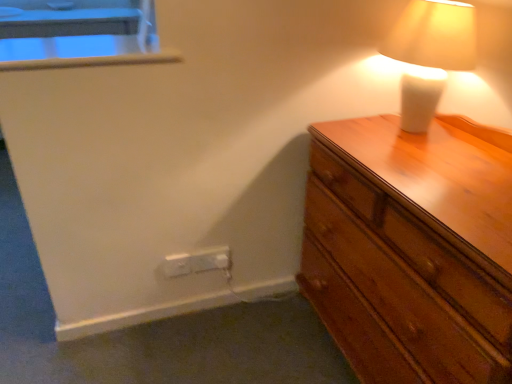
Question: Does white plastic electric outlet at lower center, the second electric outlet positioned from the left, have a greater width compared to white plastic window sill at upper left?

Choices:
 (A) yes
 (B) no

Answer: (B)

Question: Considering the relative sizes of white plastic electric outlet at lower center, which ranks as the first electric outlet in right-to-left order, and white plastic window sill at upper left in the image provided, is white plastic electric outlet at lower center, which ranks as the first electric outlet in right-to-left order, thinner than white plastic window sill at upper left?

Choices:
 (A) yes
 (B) no

Answer: (A)

Question: Considering the relative sizes of white plastic electric outlet at lower center, the second electric outlet positioned from the left, and white plastic window sill at upper left in the image provided, is white plastic electric outlet at lower center, the second electric outlet positioned from the left, taller than white plastic window sill at upper left?

Choices:
 (A) no
 (B) yes

Answer: (B)

Question: From the image's perspective, is white plastic electric outlet at lower center, the second electric outlet positioned from the left, beneath white plastic window sill at upper left?

Choices:
 (A) no
 (B) yes

Answer: (B)

Question: Is white plastic electric outlet at lower center, which ranks as the first electric outlet in right-to-left order, far away from white plastic window sill at upper left?

Choices:
 (A) no
 (B) yes

Answer: (A)

Question: Does white plastic electric outlet at lower center, the second electric outlet positioned from the left, have a smaller size compared to white plastic window sill at upper left?

Choices:
 (A) no
 (B) yes

Answer: (B)

Question: Is white ceramic lamp at upper right in front of white plastic electric outlet at lower left, the first electric outlet from the left?

Choices:
 (A) no
 (B) yes

Answer: (B)

Question: Can you confirm if white ceramic lamp at upper right is positioned to the left of white plastic electric outlet at lower left, which ranks as the 2th electric outlet in right-to-left order?

Choices:
 (A) no
 (B) yes

Answer: (A)

Question: Does white ceramic lamp at upper right have a lesser width compared to white plastic electric outlet at lower left, the first electric outlet from the left?

Choices:
 (A) no
 (B) yes

Answer: (A)

Question: Does white ceramic lamp at upper right have a greater width compared to white plastic electric outlet at lower left, the first electric outlet from the left?

Choices:
 (A) no
 (B) yes

Answer: (B)

Question: Considering the relative sizes of white ceramic lamp at upper right and white plastic electric outlet at lower left, which ranks as the 2th electric outlet in right-to-left order, in the image provided, is white ceramic lamp at upper right shorter than white plastic electric outlet at lower left, which ranks as the 2th electric outlet in right-to-left order,?

Choices:
 (A) yes
 (B) no

Answer: (B)

Question: Does white ceramic lamp at upper right have a smaller size compared to white plastic electric outlet at lower left, the first electric outlet from the left?

Choices:
 (A) no
 (B) yes

Answer: (A)

Question: Considering the relative sizes of white plastic electric outlet at lower left, the first electric outlet from the left, and white ceramic lamp at upper right in the image provided, is white plastic electric outlet at lower left, the first electric outlet from the left, thinner than white ceramic lamp at upper right?

Choices:
 (A) no
 (B) yes

Answer: (B)